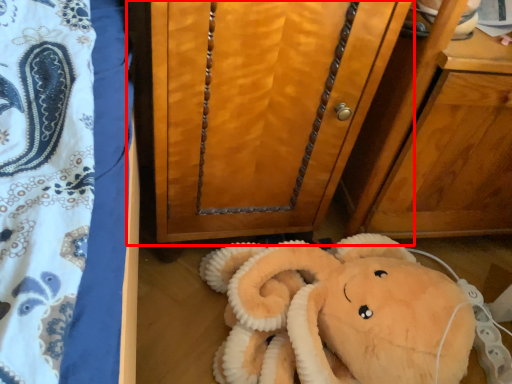
Question: From the image, what is the correct spatial relationship of furniture (annotated by the red box) in relation to toy?

Choices:
 (A) left
 (B) right

Answer: (A)